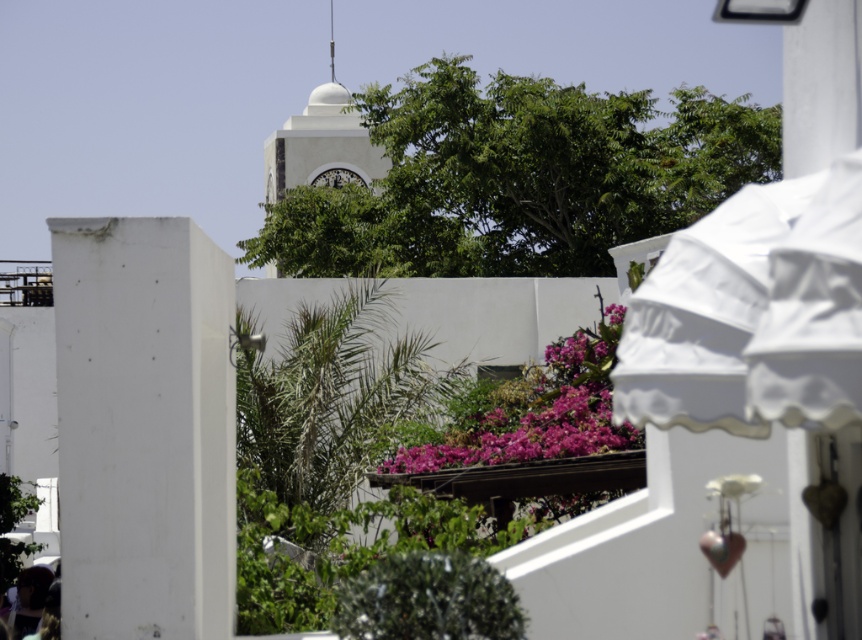
Which of these two, green leafy bush at center or white smooth clock tower at center, stands shorter?

green leafy bush at center is shorter.

Is green leafy bush at center smaller than white smooth clock tower at center?

Indeed, green leafy bush at center has a smaller size compared to white smooth clock tower at center.

This screenshot has height=640, width=862. I want to click on green leafy bush at center, so click(428, 600).

The width and height of the screenshot is (862, 640). I want to click on green leafy bush at center, so click(x=428, y=600).

Which is above, white matte pillar at left or white smooth clock tower at center?

Positioned higher is white smooth clock tower at center.

Is white matte pillar at left in front of white smooth clock tower at center?

Yes.

What do you see at coordinates (144, 428) in the screenshot? I see `white matte pillar at left` at bounding box center [144, 428].

Where is `white matte pillar at left`? The height and width of the screenshot is (640, 862). white matte pillar at left is located at coordinates (144, 428).

Which of these two, white matte pillar at left or green leafy bush at center, stands taller?

With more height is white matte pillar at left.

Does white matte pillar at left have a greater height compared to green leafy bush at center?

Yes.

At what (x,y) coordinates should I click in order to perform the action: click on white matte pillar at left. Please return your answer as a coordinate pair (x, y). The width and height of the screenshot is (862, 640). Looking at the image, I should click on (144, 428).